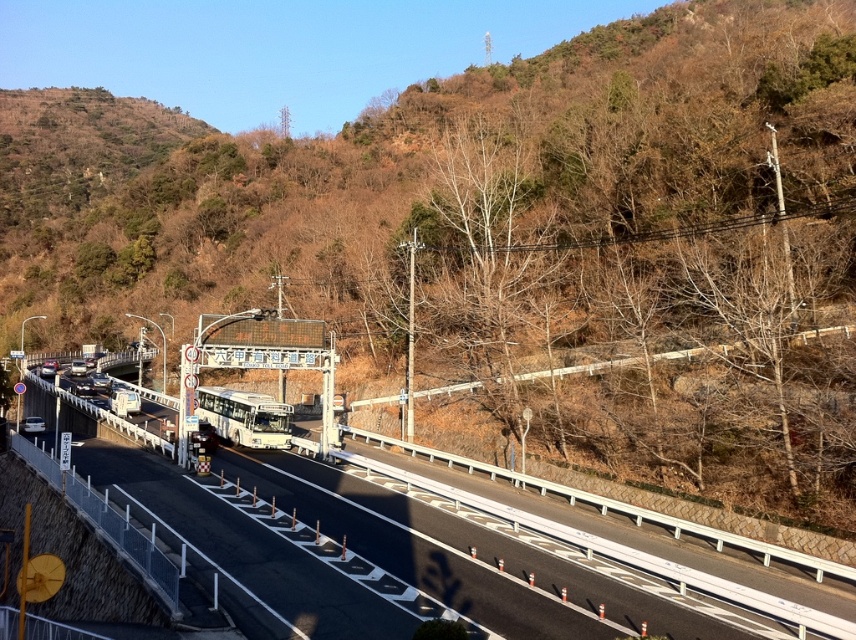
Does white asphalt highway at center have a larger size compared to white matte bus at center?

Yes, white asphalt highway at center is bigger than white matte bus at center.

Looking at this image, is white asphalt highway at center positioned at the back of white matte bus at center?

No, it is in front of white matte bus at center.

Image resolution: width=856 pixels, height=640 pixels. I want to click on white asphalt highway at center, so click(628, 563).

From the picture: Is brown leafy hillside at upper center thinner than white asphalt highway at center?

Incorrect, brown leafy hillside at upper center's width is not less than white asphalt highway at center's.

In order to click on brown leafy hillside at upper center in this screenshot , I will do `click(423, 170)`.

In order to click on brown leafy hillside at upper center in this screenshot , I will do `click(423, 170)`.

This screenshot has width=856, height=640. Identify the location of brown leafy hillside at upper center. (423, 170).

Which is in front, point (597, 193) or point (223, 388)?

Positioned in front is point (223, 388).

The image size is (856, 640). Find the location of `brown leafy hillside at upper center`. brown leafy hillside at upper center is located at coordinates click(423, 170).